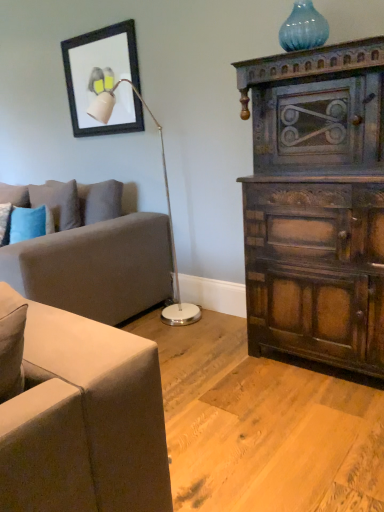
Find the location of a particular element. This screenshot has height=512, width=384. empty space that is ontop of blue glass vase at upper right (from a real-world perspective) is located at coordinates (304, 7).